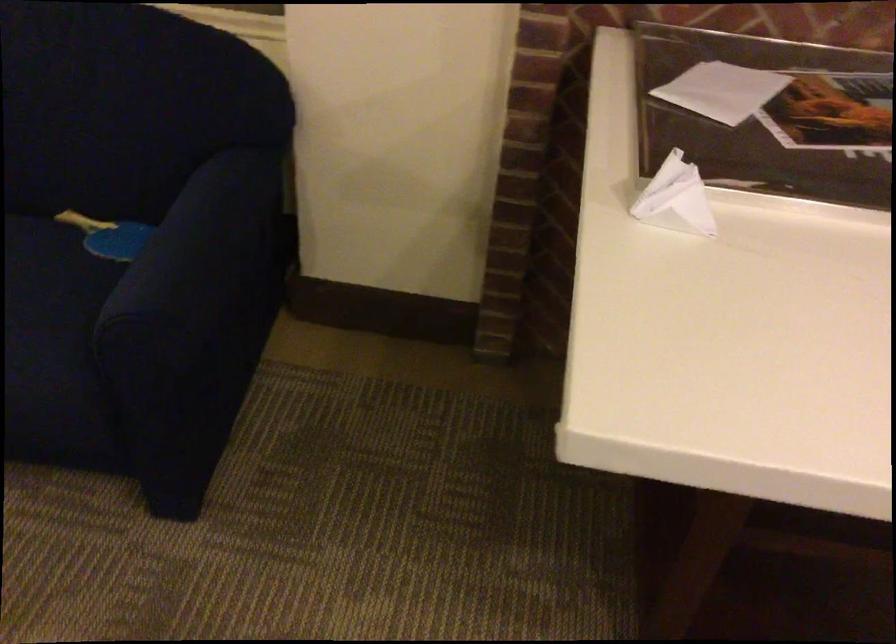
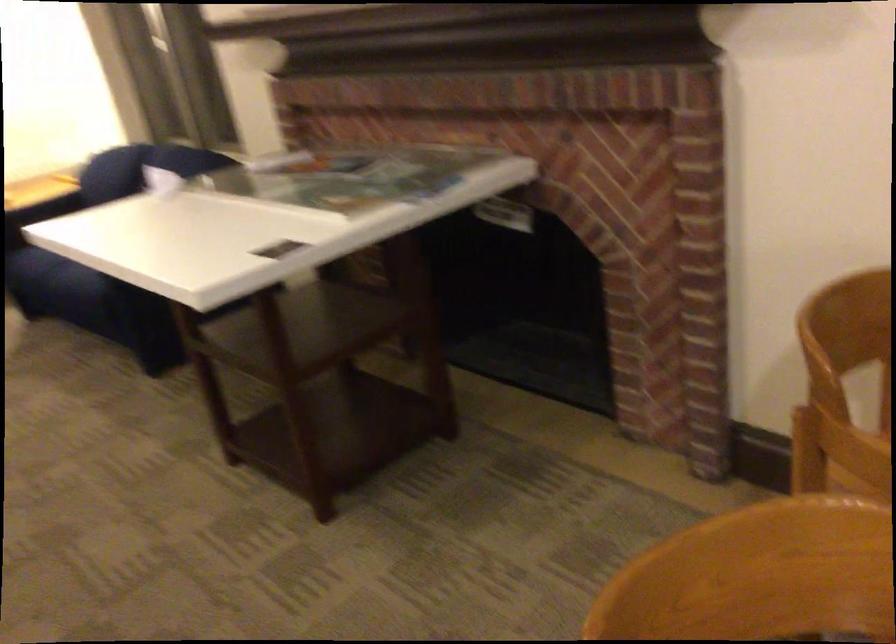
Question: I am providing you with two images of the same scene from different viewpoints. Please identify which objects are invisible in image2.

Choices:
 (A) sofa sitting surface
 (B) patterned lumbar pillow
 (C) blue ping pong paddle
 (D) sofa armrest

Answer: (C)